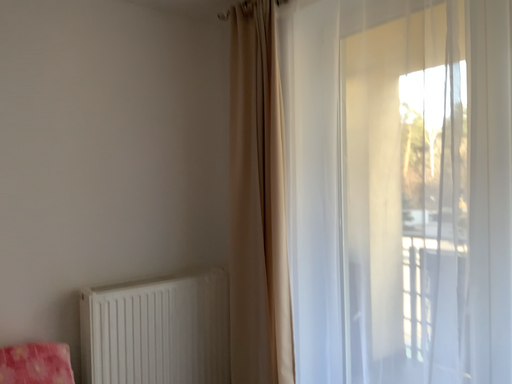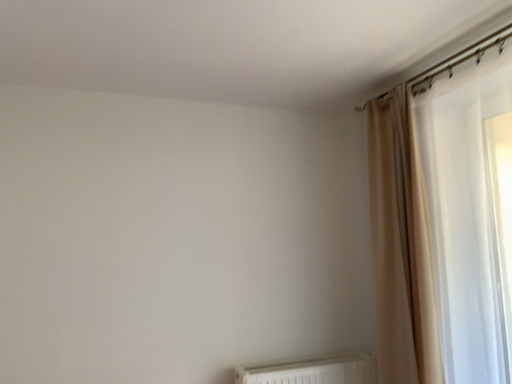
Question: Which way did the camera rotate in the video?

Choices:
 (A) rotated left
 (B) rotated right

Answer: (A)